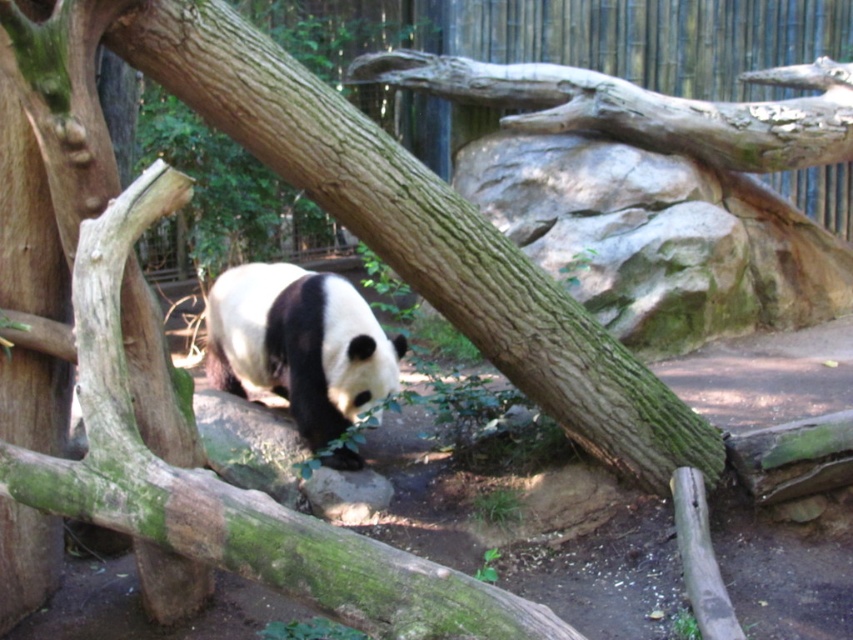
You are a zookeeper who needs to reach the smooth brown branch at upper center to trim it. The longest pole you have is 20 feet. Can you reach it with your current pole?

The smooth brown branch at upper center is 22.63 feet from camera, so the pole is not long enough to reach it. You need a longer pole.

You are a zookeeper observing the enclosure. You need to determine if the smooth brown branch at upper center is taller than the black fuzzy panda at center. Based on the scene, what can you conclude?

The smooth brown branch at upper center has a lesser height compared to the black fuzzy panda at center, so the branch is shorter than the panda.

You are a zookeeper who needs to feed the black fuzzy panda at center. There is a smooth brown branch at upper center hanging above it. Can you safely place food under the branch without it falling on the panda?

The smooth brown branch at upper center is positioned over the black fuzzy panda at center, so placing food directly under the branch may cause the branch to shift or drop debris onto the panda. It is safer to place food away from the area beneath the branch.